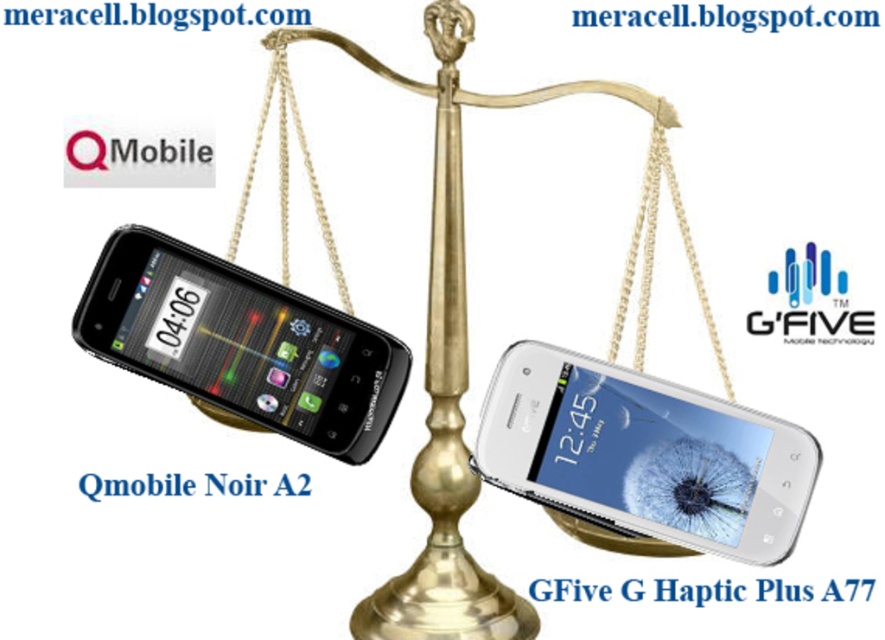
Question: Can you confirm if white glossy smartphone at center is positioned to the left of black glossy qmobile noir a2 at left?

Choices:
 (A) no
 (B) yes

Answer: (A)

Question: Is white glossy smartphone at center thinner than black glossy qmobile noir a2 at left?

Choices:
 (A) no
 (B) yes

Answer: (B)

Question: Among these points, which one is nearest to the camera?

Choices:
 (A) (660, 417)
 (B) (281, 358)

Answer: (A)

Question: Among these objects, which one is farthest from the camera?

Choices:
 (A) black glossy qmobile noir a2 at left
 (B) white glossy smartphone at center

Answer: (A)

Question: Which of the following is the closest to the observer?

Choices:
 (A) white glossy smartphone at center
 (B) black glossy qmobile noir a2 at left

Answer: (A)

Question: Observing the image, what is the correct spatial positioning of white glossy smartphone at center in reference to black glossy qmobile noir a2 at left?

Choices:
 (A) above
 (B) below

Answer: (B)